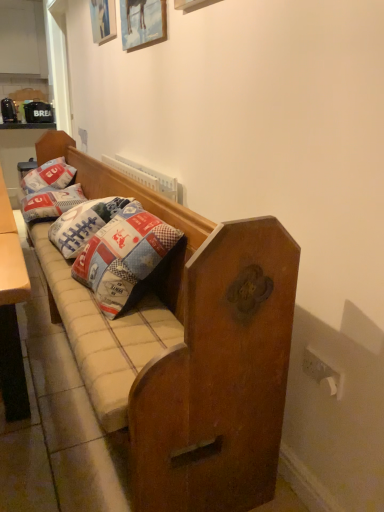
Question: From a real-world perspective, is patchwork fabric pillow at left, arranged as the 1th pillow when viewed from the front, above or below wooden picture frame at upper center, the 1th picture frame from the bottom?

Choices:
 (A) above
 (B) below

Answer: (B)

Question: In terms of size, does patchwork fabric pillow at left, arranged as the 1th pillow when viewed from the front, appear bigger or smaller than wooden picture frame at upper center, the 1th picture frame from the bottom?

Choices:
 (A) big
 (B) small

Answer: (A)

Question: Estimate the real-world distances between objects in this image. Which object is closer to the patchwork fabric pillow at left, which is counted as the 1th pillow, starting from the back?

Choices:
 (A) patchwork fabric pillow at left, placed as the 2th pillow when sorted from back to front
 (B) wooden picture frame at upper center, which appears as the 2th picture frame when viewed from the top
 (C) wooden picture frame at upper center, the second picture frame viewed from the front
 (D) white glossy cabinet at upper left
 (E) wooden studio couch at center

Answer: (A)

Question: Considering the real-world distances, which object is closest to the white glossy cabinet at upper left?

Choices:
 (A) patchwork fabric pillow at left, placed as the 2th pillow when sorted from back to front
 (B) patchwork fabric pillow at left, the second pillow in the front-to-back sequence
 (C) wooden picture frame at upper center, which is the 2th picture frame from bottom to top
 (D) wooden studio couch at center
 (E) wooden picture frame at upper center, which ranks as the first picture frame in front-to-back order

Answer: (B)